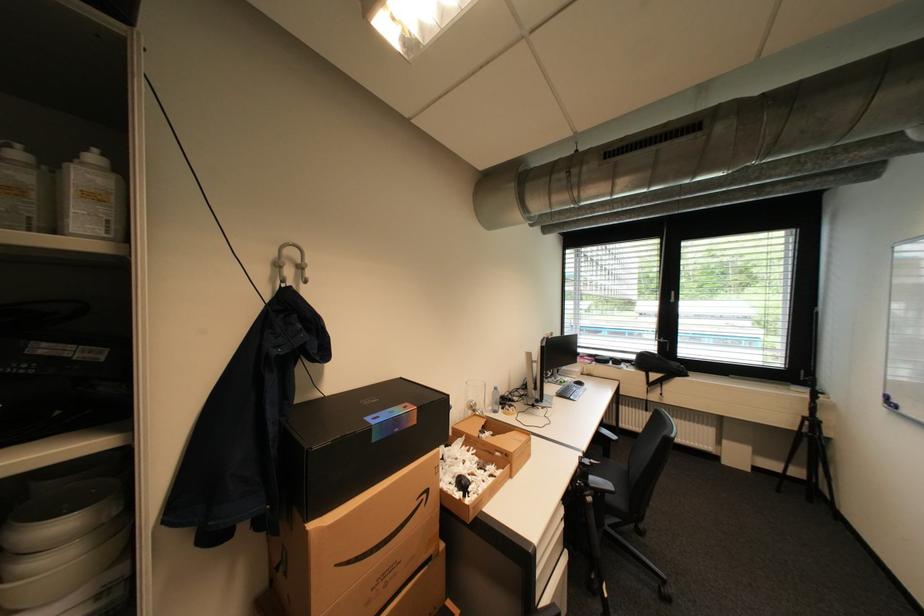
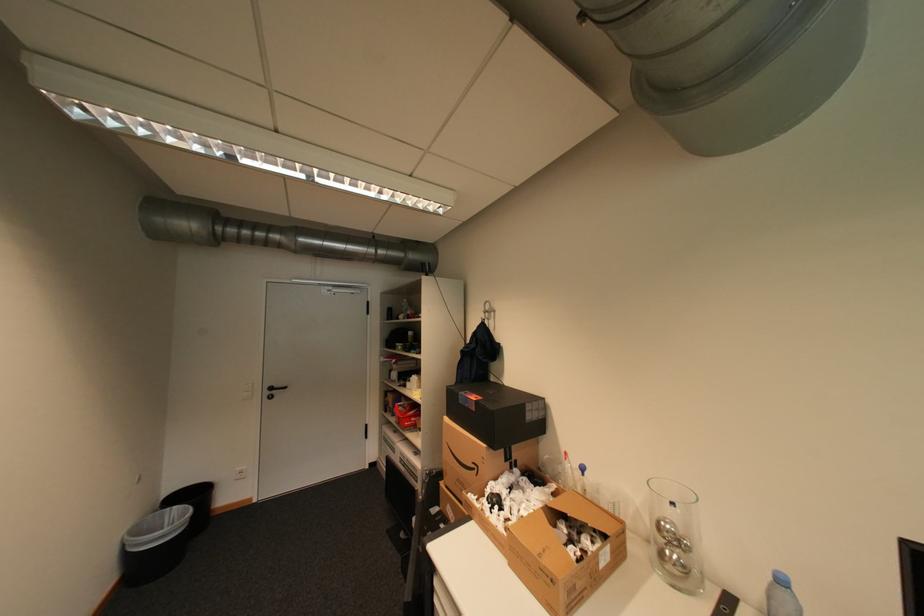
Find the pixel in the second image that matches [433,496] in the first image.

(484, 468)